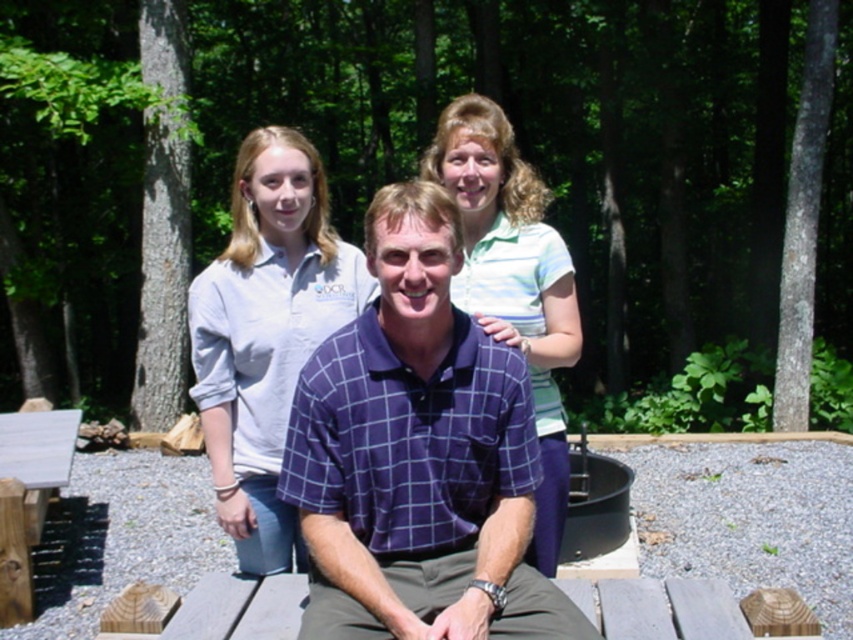
Question: Which is farther from the light blue cotton shirt at upper left?

Choices:
 (A) purple checkered shirt at center
 (B) green striped polo shirt at upper center
 (C) wooden picnic table at lower left

Answer: (C)

Question: Can you confirm if green striped polo shirt at upper center is smaller than wooden picnic table at lower left?

Choices:
 (A) no
 (B) yes

Answer: (B)

Question: Can you confirm if light blue cotton shirt at upper left is positioned to the right of wooden picnic table at lower left?

Choices:
 (A) yes
 (B) no

Answer: (A)

Question: Is green striped polo shirt at upper center wider than wooden picnic table at lower left?

Choices:
 (A) yes
 (B) no

Answer: (B)

Question: Which of the following is the closest to the observer?

Choices:
 (A) green striped polo shirt at upper center
 (B) purple checkered shirt at center
 (C) light blue cotton shirt at upper left

Answer: (B)

Question: Which of the following is the closest to the observer?

Choices:
 (A) (294, 243)
 (B) (71, 460)
 (C) (421, 394)

Answer: (C)